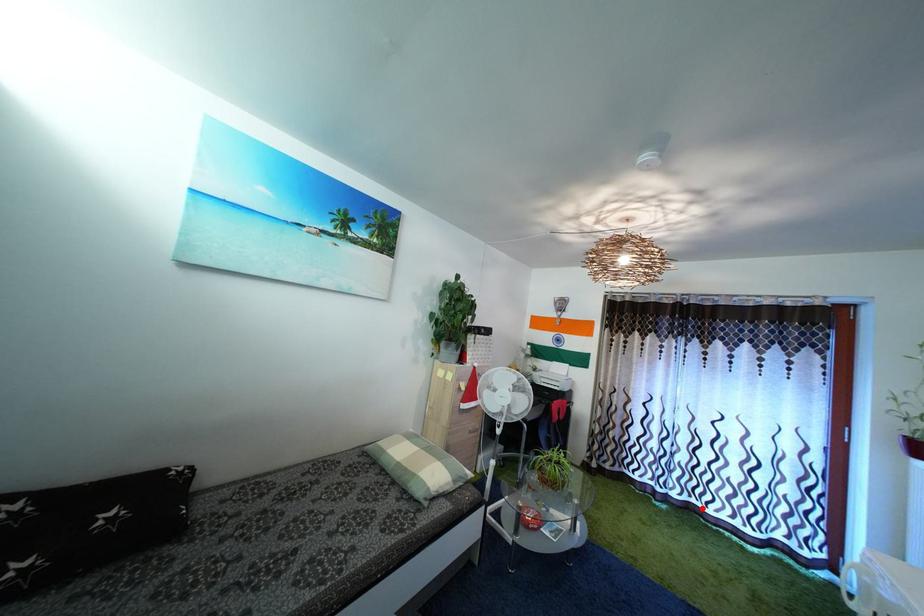
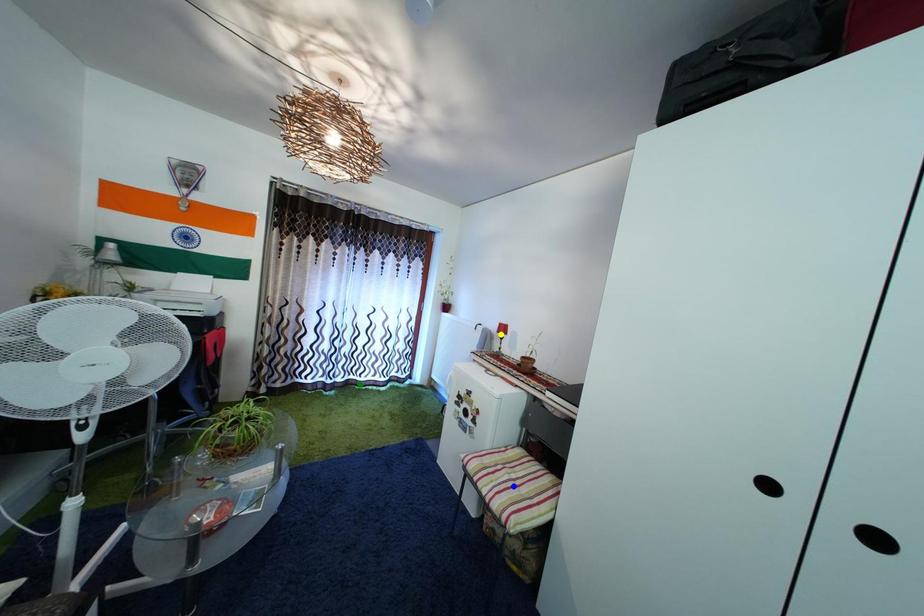
Question: I am providing you with two images of the same scene from different viewpoints. A red point is marked on the first image. You are given multiple points on the second image. In image 2, which mark is for the same physical point as the one in image 1?

Choices:
 (A) green point
 (B) blue point
 (C) yellow point

Answer: (A)